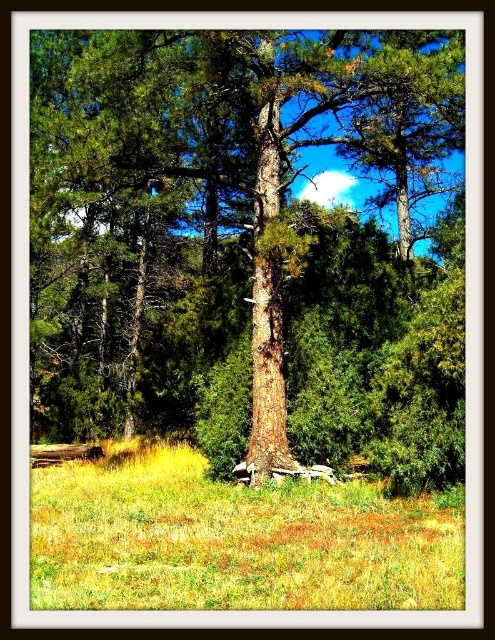
Question: Is brown rough bark tree at center to the right of yellow grass at center from the viewer's perspective?

Choices:
 (A) yes
 (B) no

Answer: (A)

Question: Is brown rough bark tree at center smaller than yellow grass at center?

Choices:
 (A) no
 (B) yes

Answer: (A)

Question: Does brown rough bark tree at center have a greater width compared to yellow grass at center?

Choices:
 (A) no
 (B) yes

Answer: (B)

Question: Among these objects, which one is nearest to the camera?

Choices:
 (A) brown rough bark tree at center
 (B) yellow grass at center

Answer: (B)